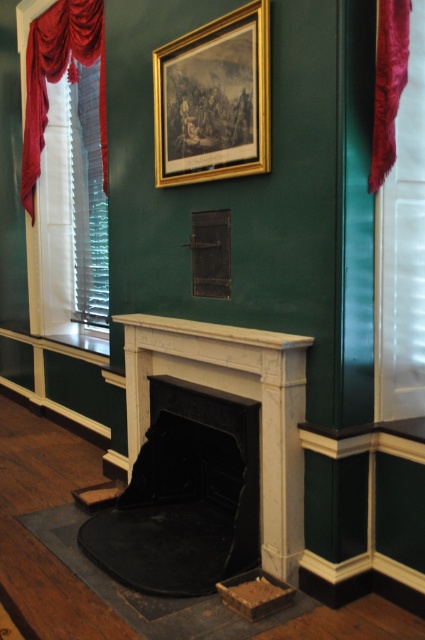
You are a professional cleaner with a 2.5 meter long pole. You need to clean the velvet drapery at left but you can only reach up to 2.5 meters. Can you reach the drapery?

The velvet drapery at left and viewer are 3.69 meters apart from each other, which is beyond the 2.5 meter reach of the pole. Therefore, you cannot reach the velvet drapery at left with the pole.